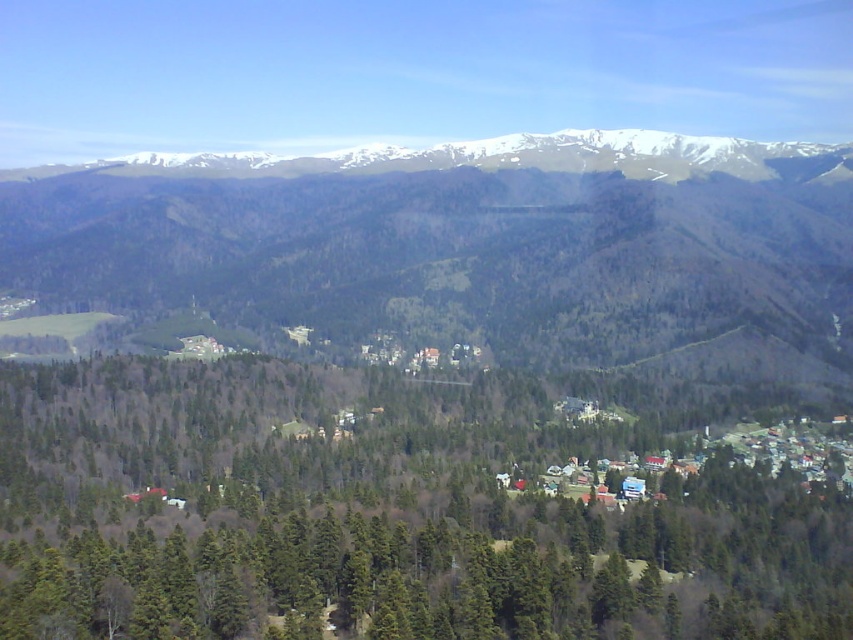
Question: Does green matte trees at center appear on the left side of snowy rock mountain range at upper center?

Choices:
 (A) yes
 (B) no

Answer: (B)

Question: Which object is farther from the camera taking this photo?

Choices:
 (A) green forested mountain range at upper center
 (B) snowy rock mountain range at upper center

Answer: (B)

Question: Based on their relative distances, which object is farther from the green forested mountain range at upper center?

Choices:
 (A) green matte trees at center
 (B) snowy rock mountain range at upper center

Answer: (A)

Question: Does green forested mountain range at upper center appear on the left side of snowy rock mountain range at upper center?

Choices:
 (A) no
 (B) yes

Answer: (B)

Question: Does green matte trees at center appear over green forested mountain range at upper center?

Choices:
 (A) no
 (B) yes

Answer: (A)

Question: Which point appears farthest from the camera in this image?

Choices:
 (A) (421, 472)
 (B) (664, 170)

Answer: (B)